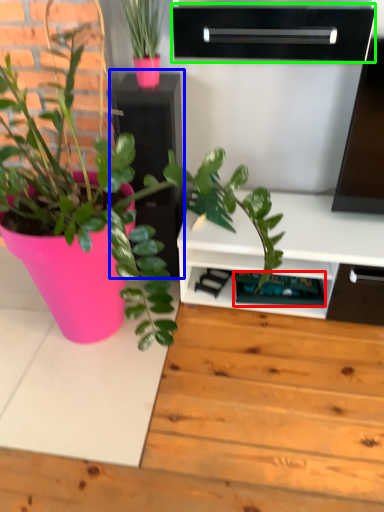
Question: Estimate the real-world distances between objects in this image. Which object is farther from shelf (highlighted by a red box), file cabinet (highlighted by a blue box) or shelf (highlighted by a green box)?

Choices:
 (A) file cabinet
 (B) shelf

Answer: (B)